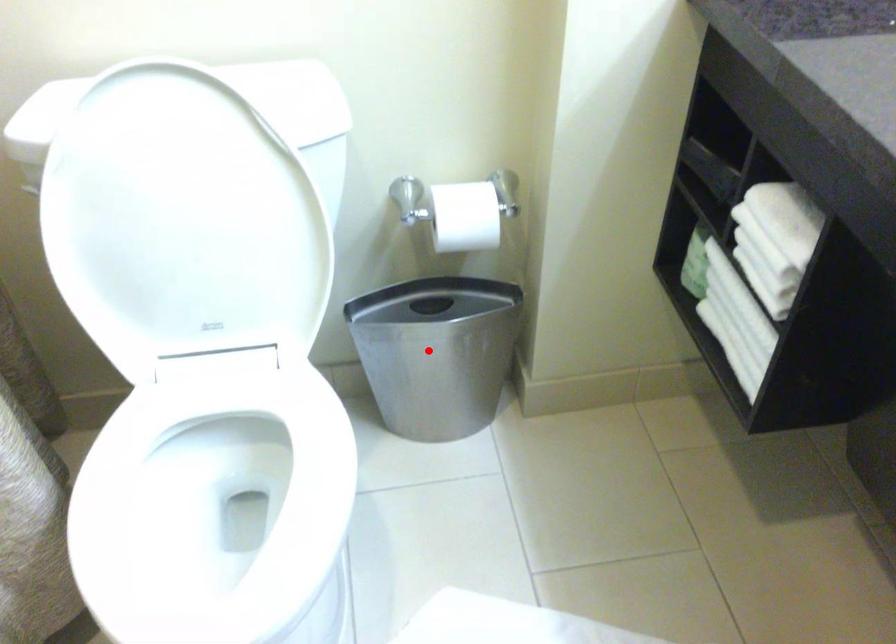
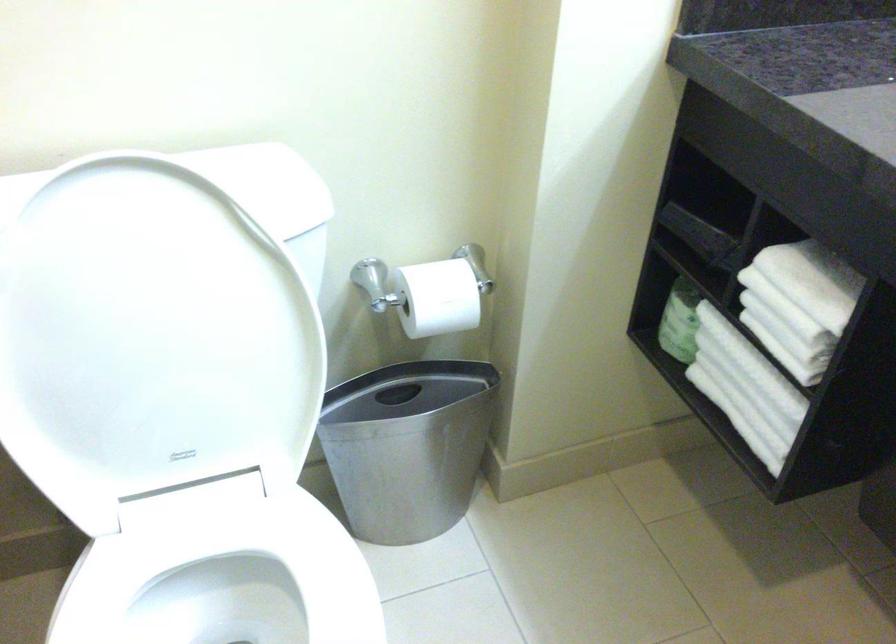
The point at the highlighted location is marked in the first image. Where is the corresponding point in the second image?

(408, 446)